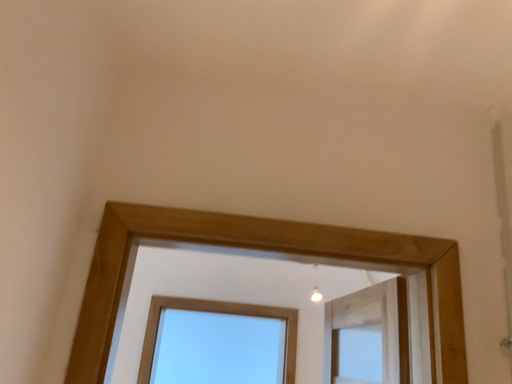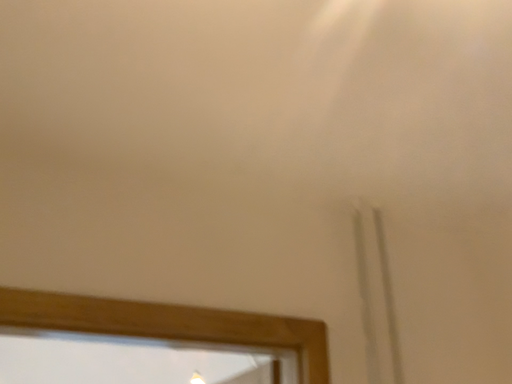
Question: How did the camera likely rotate when shooting the video?

Choices:
 (A) rotated downward
 (B) rotated upward

Answer: (B)